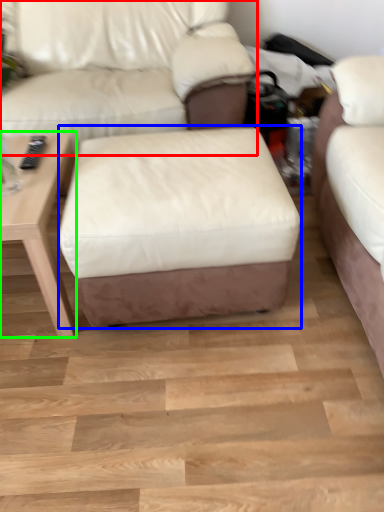
Question: Based on their relative distances, which object is nearer to studio couch (highlighted by a red box)? Choose from stool (highlighted by a blue box) and table (highlighted by a green box).

Choices:
 (A) stool
 (B) table

Answer: (B)